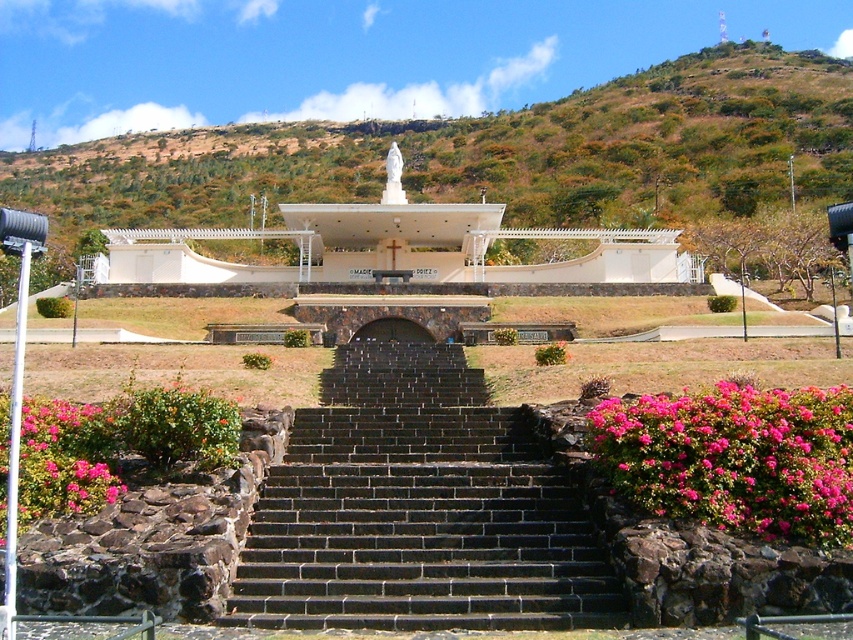
You are standing at the bottom of the staircase and want to take a photo of the green leafy hillside at upper center and the pink matte flowers at lower left. Which object will appear closer to you in the photo?

The green leafy hillside at upper center will appear closer in the photo because it is closer to the viewer than the pink matte flowers at lower left.

You are standing at the base of the staircase in the image and want to reach the monument at the top. There are two points marked on the path leading to the monument. The first point is at coordinate point(659, 474) and the second is at point(62, 458). Which point should you walk towards first to reach the monument?

You should walk towards point(659, 474) first because it is in front of point(62, 458), meaning it is closer to your current position at the base of the staircase.

You are planning to take a photo of the green leafy hillside at upper center and the pink matte flowers at lower left. Which object will occupy more space in the photo frame?

The green leafy hillside at upper center will occupy more space in the photo frame because its width is larger than the pink matte flowers at lower left.